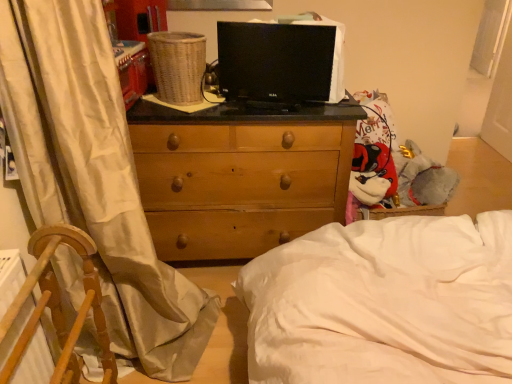
At what (x,y) coordinates should I click in order to perform the action: click on free space underneath black glossy tv at center (from a real-world perspective). Please return your answer as a coordinate pair (x, y). This screenshot has width=512, height=384. Looking at the image, I should click on (268, 111).